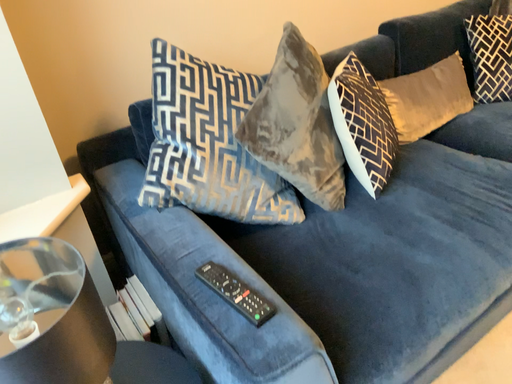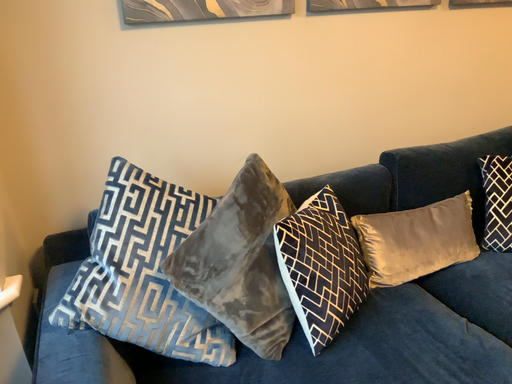
Question: Which way did the camera rotate in the video?

Choices:
 (A) rotated left
 (B) rotated right

Answer: (A)